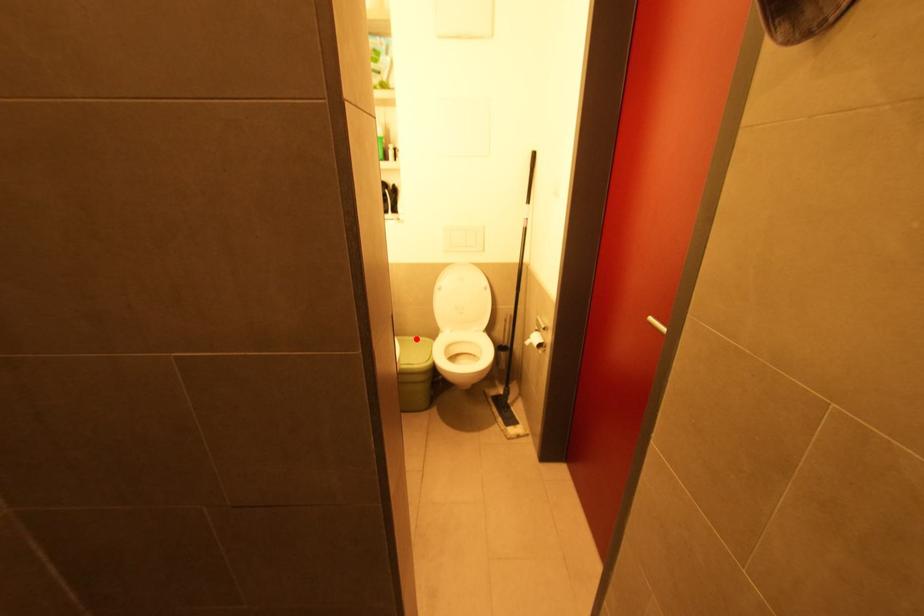
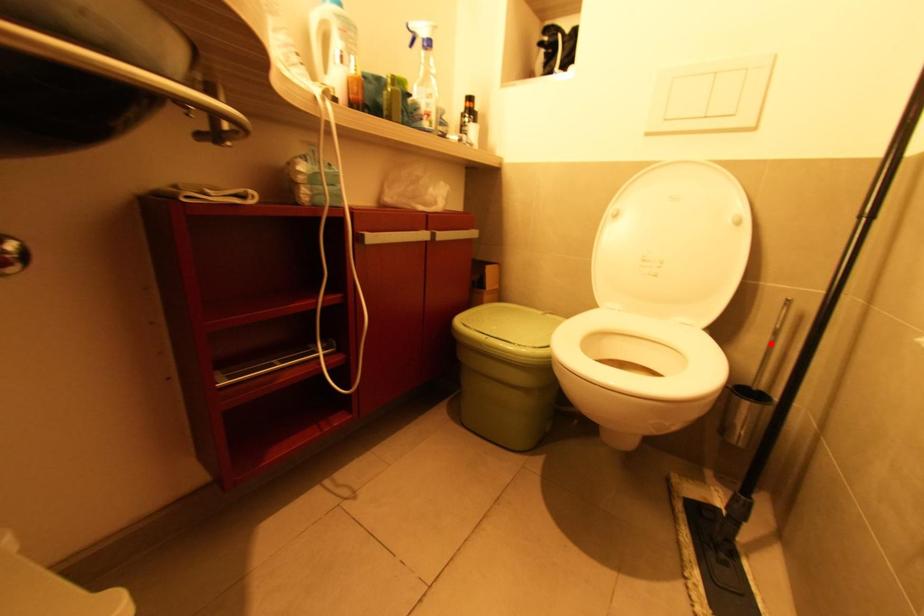
I am providing you with two images of the same scene from different viewpoints. A red point is marked on the first image and another point is marked on the second image. Does the point marked in image1 correspond to the same location as the one in image2?

No